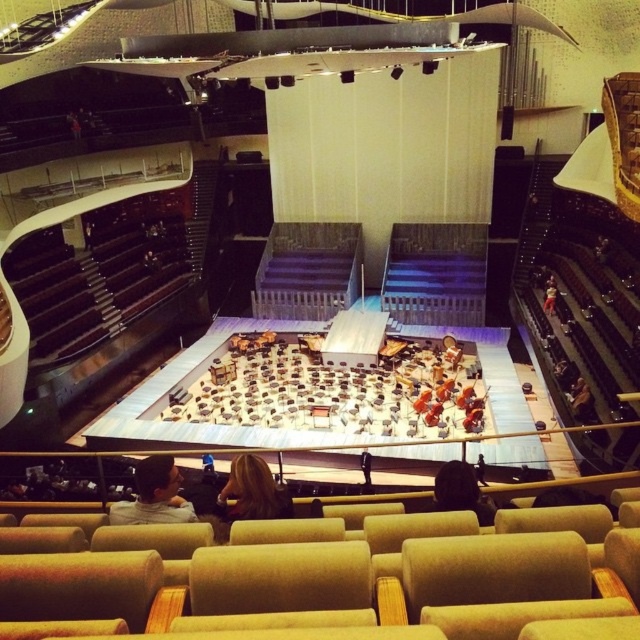
You are sitting in the concert hall and see the brown hair at center and the black leather jacket at center on stage. Which object is closer to you?

The brown hair at center is closer to you because it is further to the viewer than the black leather jacket at center.

You are standing at the entrance of the concert hall and want to locate the light brown leather jacket at lower center. According to the coordinates provided, where should you look relative to the stage?

The light brown leather jacket at lower center is located at coordinates point (x=154, y=496), which is closer to the right side and lower part of the image, meaning it is positioned near the stage area on the right side from your viewpoint at the entrance.

You are sitting in the concert hall and see the point marked at coordinates (x=154, y=496). What object is located at that point?

The point at coordinates (x=154, y=496) corresponds to the light brown leather jacket at lower center.